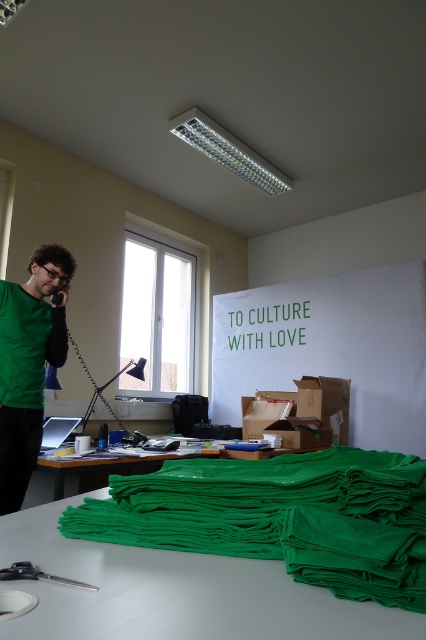
What are the coordinates of the green matte shirt at left in the image?

The green matte shirt at left is located at coordinates point (28, 364).

In the scene shown: You are organizing a photo shoot and need to ensure proper lighting for two green items in the scene. The green fabric at lower center and the green matte shirt at left. Which one is located to the right of the other?

The green fabric at lower center is positioned on the right side of green matte shirt at left.

You are organizing a photoshoot and need to ensure that the green fabric at lower center and the green matte shirt at left are both visible in the frame. Which object should you prioritize positioning closer to the camera to ensure visibility, considering their sizes?

The green fabric at lower center has a greater width than the green matte shirt at left, so you should prioritize positioning the green fabric at lower center closer to the camera to ensure visibility.